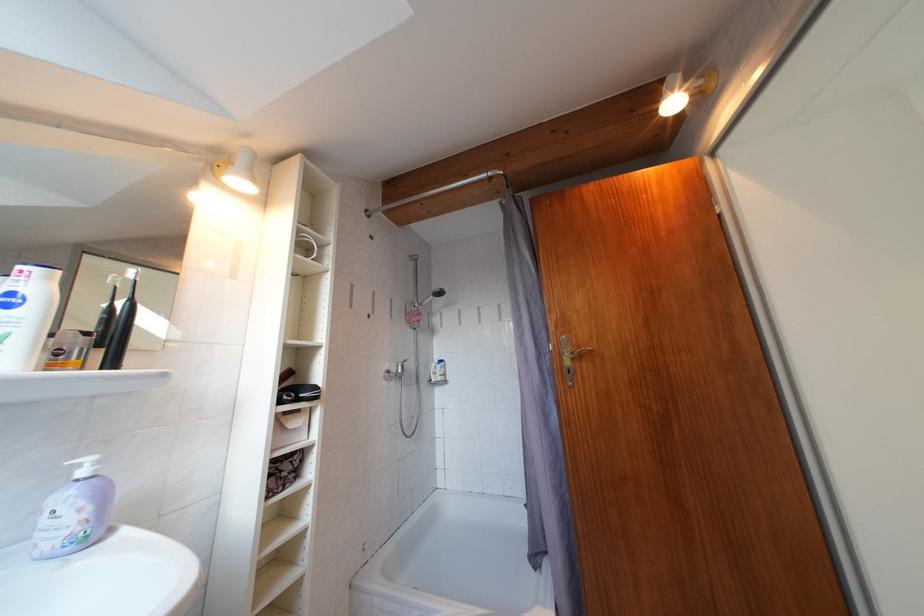
Describe the element at coordinates (84, 467) in the screenshot. I see `a soap dispenser pump` at that location.